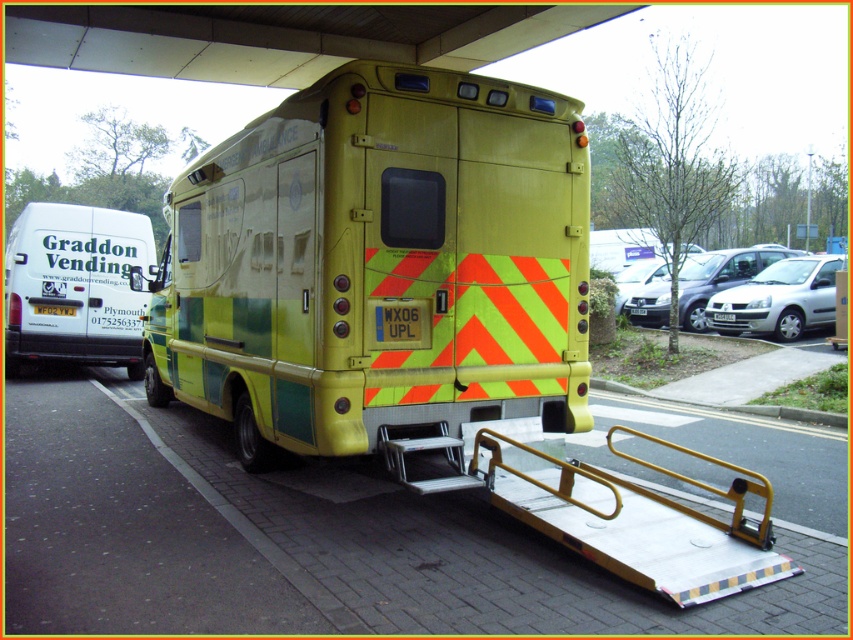
Is yellow/green painted ambulance at center bigger than yellow reflective plate at rear?

Yes, yellow/green painted ambulance at center is bigger than yellow reflective plate at rear.

Does yellow/green painted ambulance at center appear on the left side of yellow reflective plate at rear?

Indeed, yellow/green painted ambulance at center is positioned on the left side of yellow reflective plate at rear.

Is point (347, 289) positioned after point (642, 312)?

No, (347, 289) is in front of (642, 312).

What are the coordinates of `yellow/green painted ambulance at center` in the screenshot? It's located at (378, 266).

Does point (715, 314) lie behind point (636, 314)?

No, (715, 314) is in front of (636, 314).

Where is `yellow plastic license plate at rear`? yellow plastic license plate at rear is located at coordinates (723, 316).

Is point (753, 314) less distant than point (42, 308)?

No, it is behind (42, 308).

Between white metallic car at right and yellow matte license plate at rear, which one is positioned lower?

yellow matte license plate at rear is lower down.

Between point (788, 337) and point (56, 308), which one is positioned in front?

Point (56, 308) is in front.

This screenshot has width=853, height=640. I want to click on white metallic car at right, so pos(780,298).